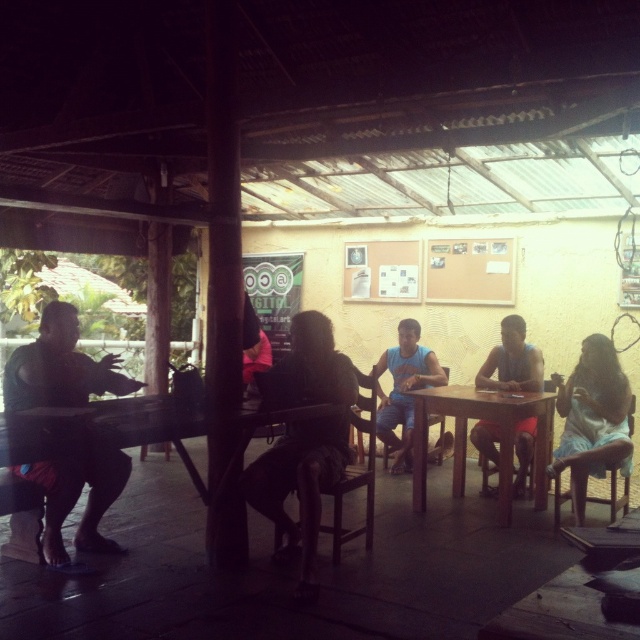
Between point (32, 483) and point (522, 397), which one is positioned behind?

Point (522, 397)

Does wooden table at lower left appear on the right side of wooden table at center?

In fact, wooden table at lower left is to the left of wooden table at center.

Which is in front, point (115, 442) or point (456, 410)?

Point (115, 442) is more forward.

Identify the location of wooden table at lower left. The width and height of the screenshot is (640, 640). (147, 433).

At what (x,y) coordinates should I click in order to perform the action: click on matte black shirt at left. Please return your answer as a coordinate pair (x, y). The height and width of the screenshot is (640, 640). Looking at the image, I should click on pyautogui.click(x=77, y=490).

Does matte black shirt at left have a larger size compared to dark brown leather chair at center?

Yes, matte black shirt at left is bigger than dark brown leather chair at center.

Measure the distance between matte black shirt at left and camera.

8.33 feet

Locate an element on the screen. The image size is (640, 640). matte black shirt at left is located at coordinates (77, 490).

Is dark brown leather chair at center positioned behind wooden table at center?

No.

Who is higher up, dark brown leather chair at center or wooden table at center?

dark brown leather chair at center is higher up.

The width and height of the screenshot is (640, 640). Identify the location of dark brown leather chair at center. (305, 444).